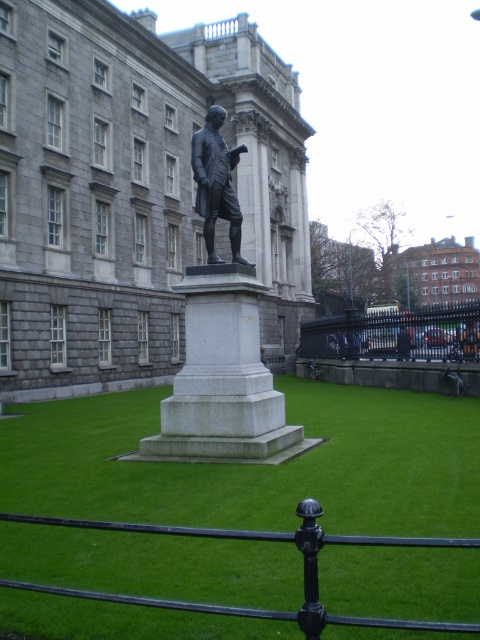
Is polished bronze statue at center bigger than bronze statue at center?

Correct, polished bronze statue at center is larger in size than bronze statue at center.

Can you confirm if polished bronze statue at center is positioned below bronze statue at center?

Indeed, polished bronze statue at center is positioned under bronze statue at center.

Measure the distance between polished bronze statue at center and camera.

The distance of polished bronze statue at center from camera is 32.26 feet.

The width and height of the screenshot is (480, 640). I want to click on polished bronze statue at center, so click(x=222, y=340).

Which is above, white marble pedestal at center or bronze statue at center?

Positioned higher is bronze statue at center.

Describe the element at coordinates (223, 378) in the screenshot. I see `white marble pedestal at center` at that location.

Who is more forward, (242, 344) or (240, 225)?

Point (242, 344)

This screenshot has height=640, width=480. In order to click on white marble pedestal at center in this screenshot , I will do `click(223, 378)`.

Does green grass at center have a smaller size compared to bronze statue at center?

No.

Is point (417, 452) in front of point (205, 150)?

Yes.

Find the location of a particular element. The width and height of the screenshot is (480, 640). green grass at center is located at coordinates (255, 465).